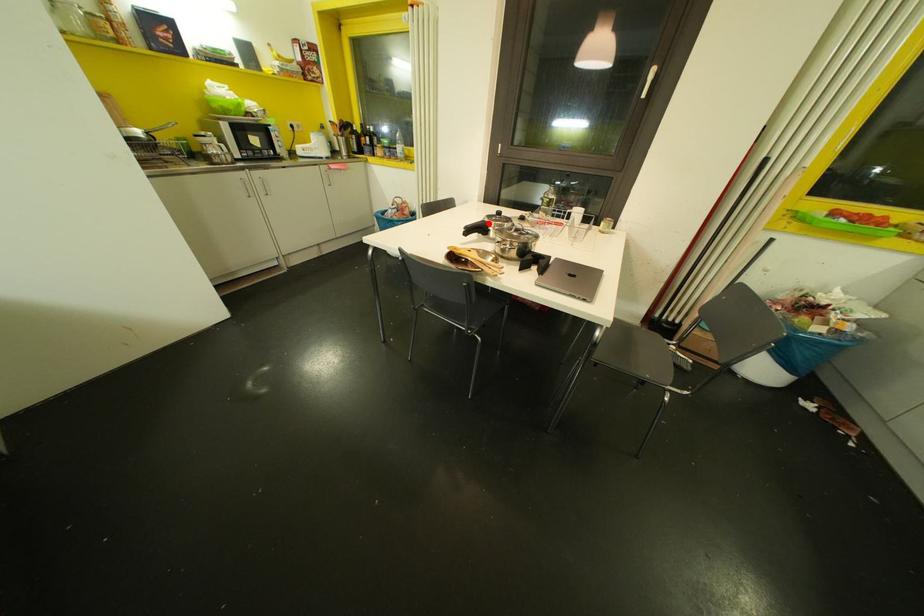
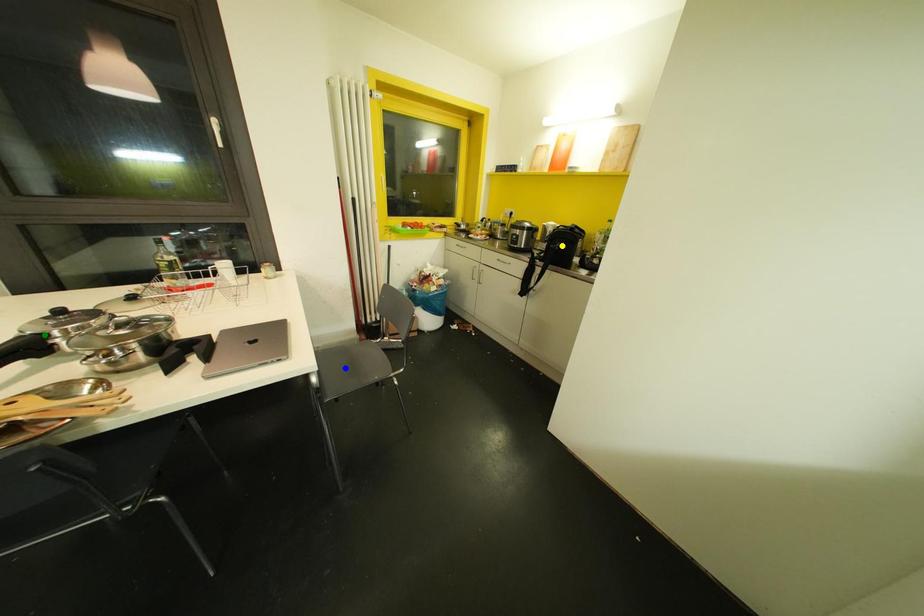
Question: I am providing you with two images of the same scene from different viewpoints. A red point is marked on the first image. You are given multiple points on the second image. Which point in image 2 is actually the same real-world point as the red point in image 1?

Choices:
 (A) blue point
 (B) green point
 (C) yellow point

Answer: (B)